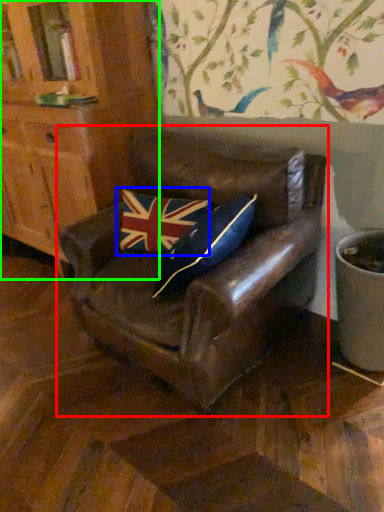
Question: Estimate the real-world distances between objects in this image. Which object is closer to chair (highlighted by a red box), flag (highlighted by a blue box) or cabinetry (highlighted by a green box)?

Choices:
 (A) flag
 (B) cabinetry

Answer: (A)